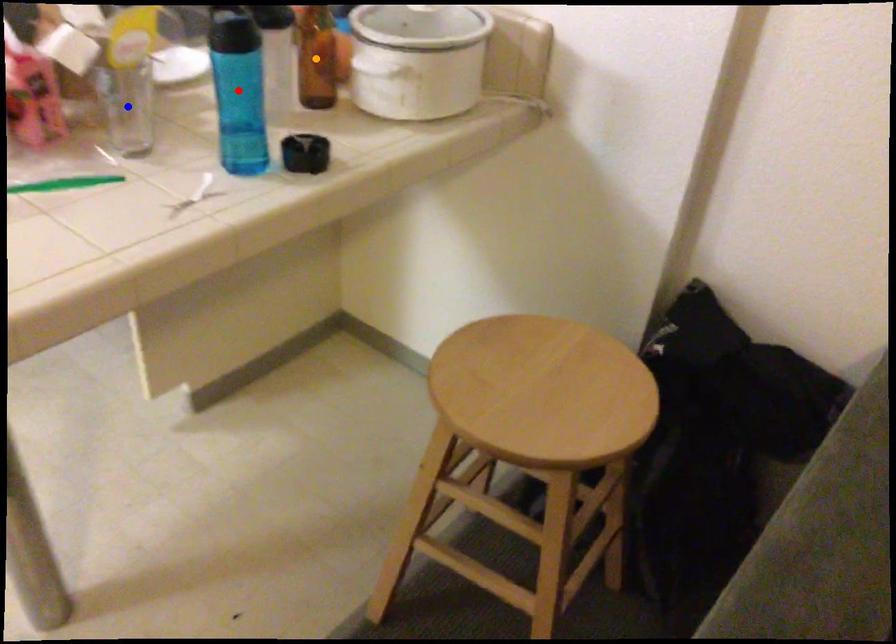
Order these from nearest to farthest:
1. red point
2. orange point
3. blue point

orange point → blue point → red point